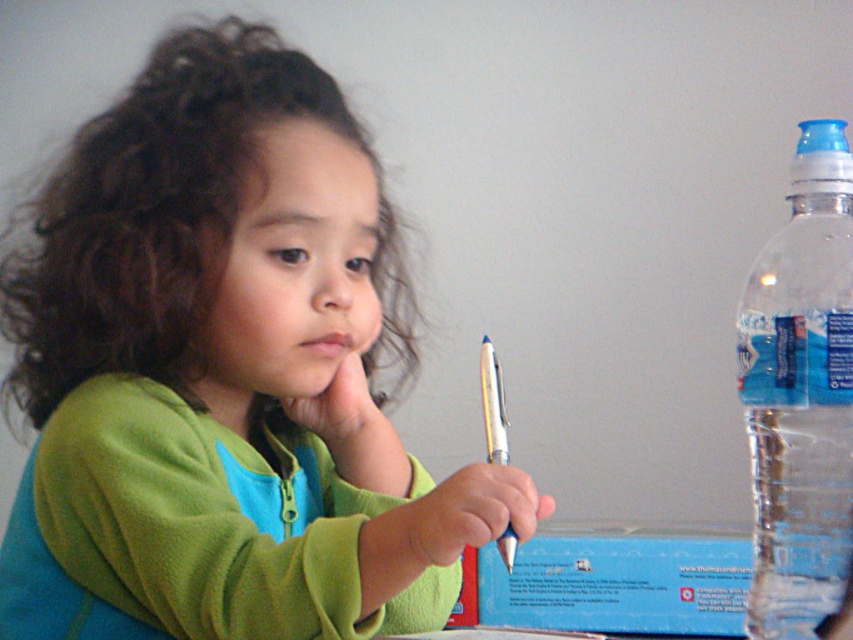
You are a photographer setting up a shoot in this scene. You want to place a small lamp between the green fleece jacket at center and the transparent plastic bottle at right to highlight both items. Based on their current positions, where should you place the lamp to ensure it is equidistant from both objects?

The green fleece jacket at center is positioned on the left side of the transparent plastic bottle at right. To place the lamp equidistant from both, position it exactly halfway between them along the horizontal axis.

You are standing in front of the table where the child is sitting. If you want to reach the transparent plastic bottle at right, in which direction should you move your hand from the center of the table?

The transparent plastic bottle at right is located at point 0.617 on the x axis and 0.940 on the y axis, so you should move your hand to the right and slightly downward from the center of the table to reach it.

You are a photographer adjusting the focus of your camera. You want to capture both the transparent plastic bottle at right and the metallic blue pen at center clearly. Which object should you focus on first to ensure both are in focus?

You should focus on the transparent plastic bottle at right first because it is closer to the viewer than the metallic blue pen at center, allowing the pen to fall within the depth of field when focusing on the nearer object.